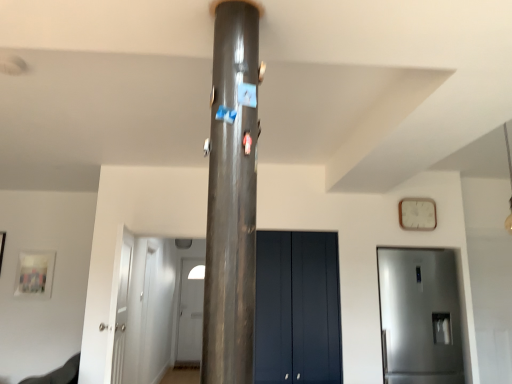
Question: Based on their positions, is white glossy door at center, the fourth door when ordered from right to left, located to the left or right of white wooden clock at upper right?

Choices:
 (A) left
 (B) right

Answer: (A)

Question: From a real-world perspective, relative to white wooden clock at upper right, is white glossy door at center, the 1th door viewed from the left, vertically above or below?

Choices:
 (A) above
 (B) below

Answer: (B)

Question: Estimate the real-world distances between objects in this image. Which object is closer to the matte dark blue cabinet at center, placed as the 3th door when sorted from left to right?

Choices:
 (A) white glossy door at center, which is the 4th door in front-to-back order
 (B) white wooden clock at upper right
 (C) white glossy door at left, positioned as the 4th door in back-to-front order
 (D) satin silver refrigerator at right, positioned as the 3th door in back-to-front order
 (E) shiny metallic pillar at center

Answer: (D)

Question: Considering the real-world distances, which object is closest to the white glossy door at center, the fourth door when ordered from right to left?

Choices:
 (A) satin silver refrigerator at right, which ranks as the first door in right-to-left order
 (B) white wooden clock at upper right
 (C) white glossy door at left, positioned as the 4th door in back-to-front order
 (D) matte dark blue cabinet at center, placed as the 3th door when sorted from front to back
 (E) shiny metallic pillar at center

Answer: (D)